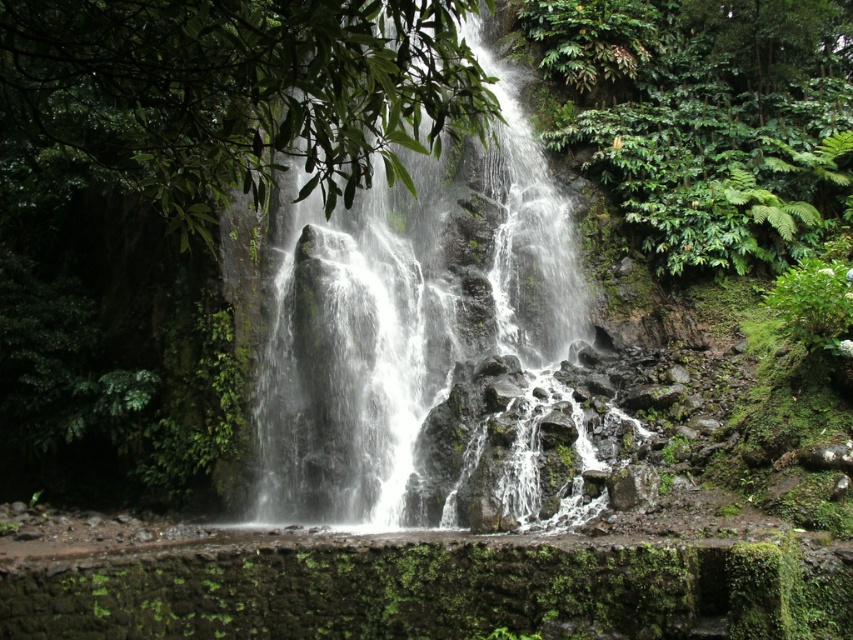
Does white frothy water at center have a greater height compared to green leafy foliage at center?

Yes, white frothy water at center is taller than green leafy foliage at center.

Is point (270, 337) positioned after point (257, 124)?

Yes.

Which is in front, point (432, 182) or point (137, 22)?

Point (137, 22) is in front.

At what (x,y) coordinates should I click in order to perform the action: click on white frothy water at center. Please return your answer as a coordinate pair (x, y). The width and height of the screenshot is (853, 640). Looking at the image, I should click on tap(413, 332).